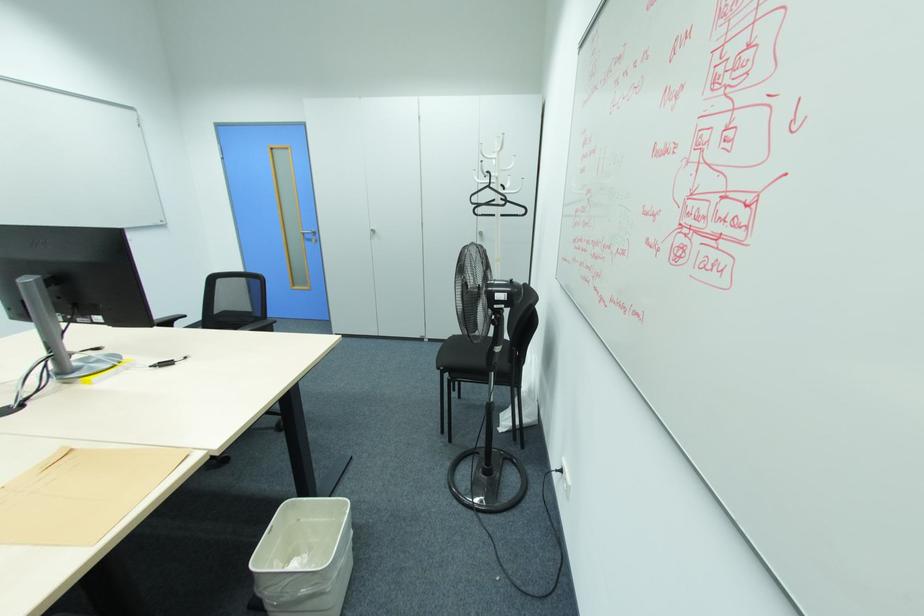
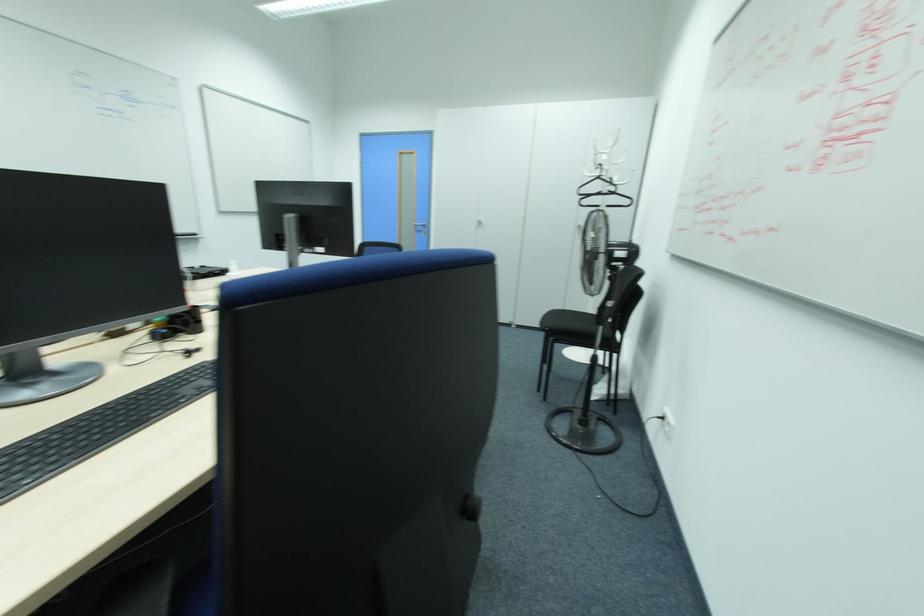
Locate, in the second image, the point that corresponds to the point at 490,187 in the first image.

(599, 177)